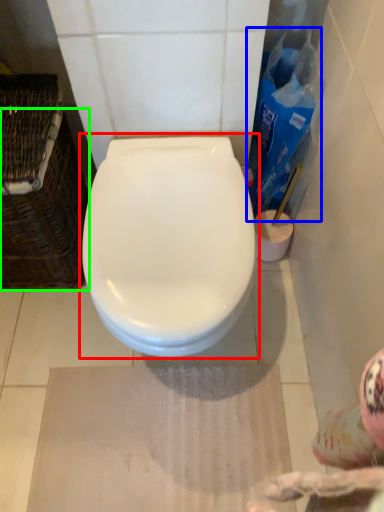
Question: Which is farther away from toilet (highlighted by a red box)? cleaning product (highlighted by a blue box) or basket (highlighted by a green box)?

Choices:
 (A) cleaning product
 (B) basket

Answer: (A)